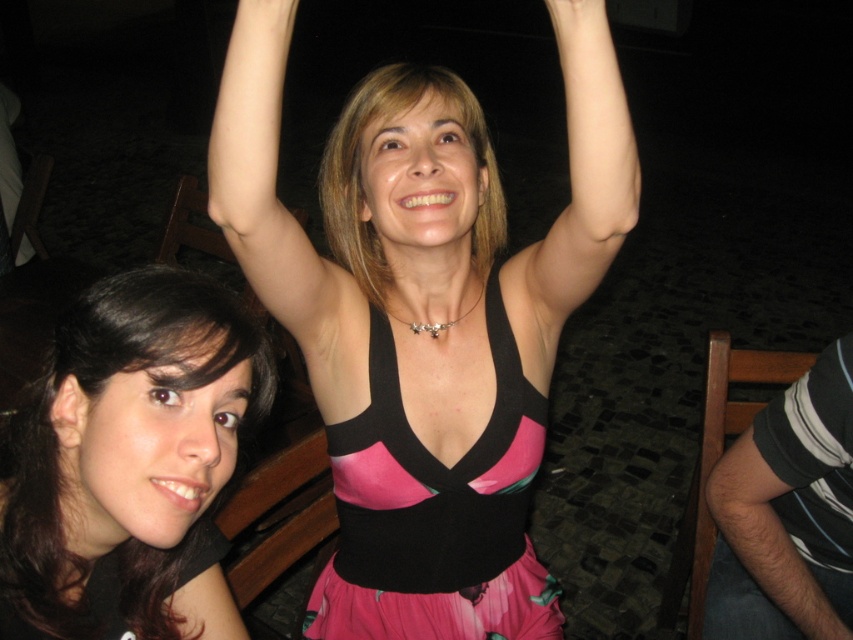
Is point (595, 33) less distant than point (556, 13)?

That is False.

Based on the photo, between pale skin at raised and smooth skin hand at upper center, which one has less height?

smooth skin hand at upper center

Who is more distant from viewer, (589, 108) or (595, 10)?

Point (589, 108)

Where is `pale skin at raised`? The image size is (853, 640). pale skin at raised is located at coordinates (585, 180).

Is point (178, 576) in front of point (219, 125)?

No, (178, 576) is behind (219, 125).

Is dark brown hair at lower left thinner than matte skin at upper center?

Incorrect, dark brown hair at lower left's width is not less than matte skin at upper center's.

Does point (148, 560) come farther from viewer compared to point (265, 74)?

Yes, point (148, 560) is farther from viewer.

What are the coordinates of `dark brown hair at lower left` in the screenshot? It's located at (131, 464).

Is pink satin dress at center above pale skin at raised?

No.

Can you confirm if pink satin dress at center is taller than pale skin at raised?

Indeed, pink satin dress at center has a greater height compared to pale skin at raised.

The height and width of the screenshot is (640, 853). Identify the location of pink satin dress at center. (436, 513).